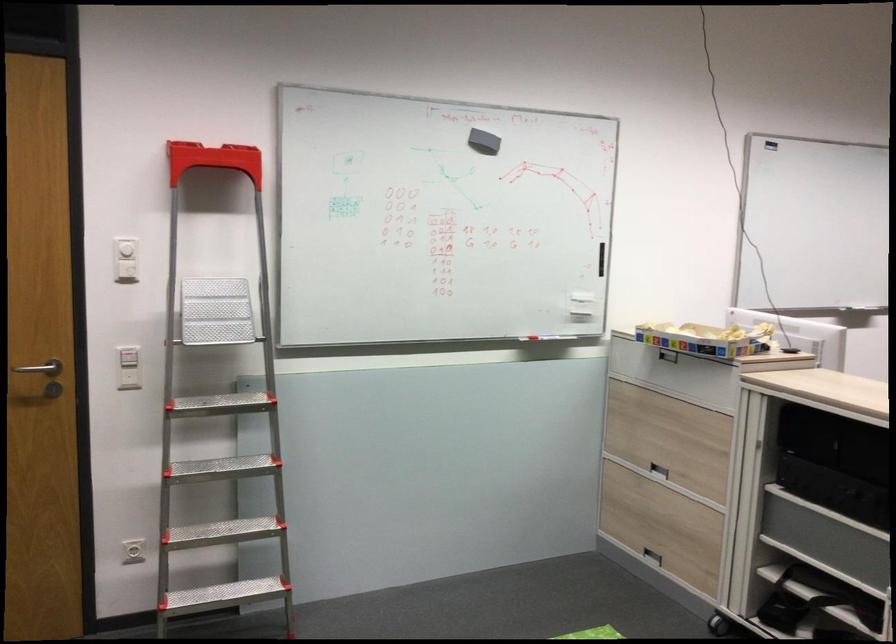
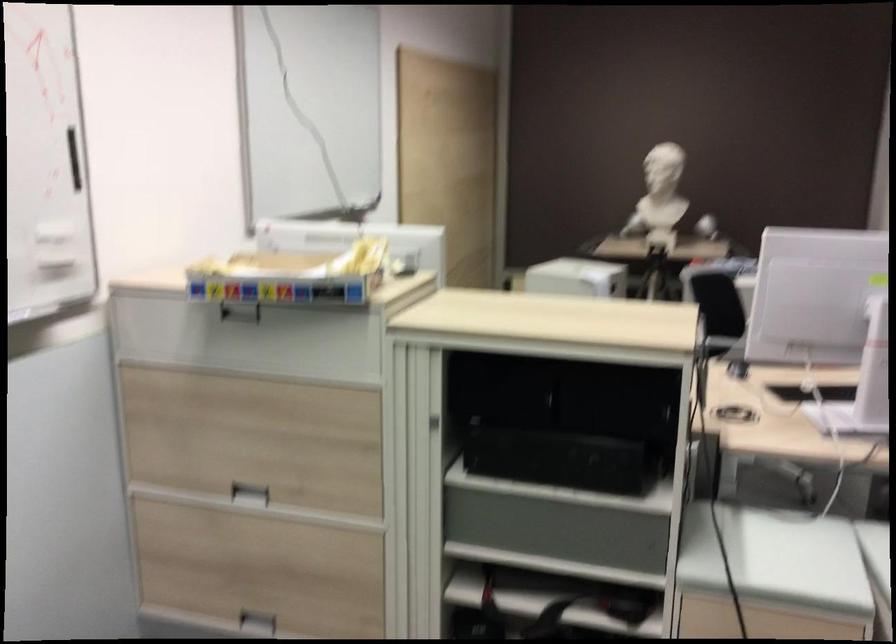
In the second image, find the point that corresponds to point 656,471 in the first image.

(250, 494)